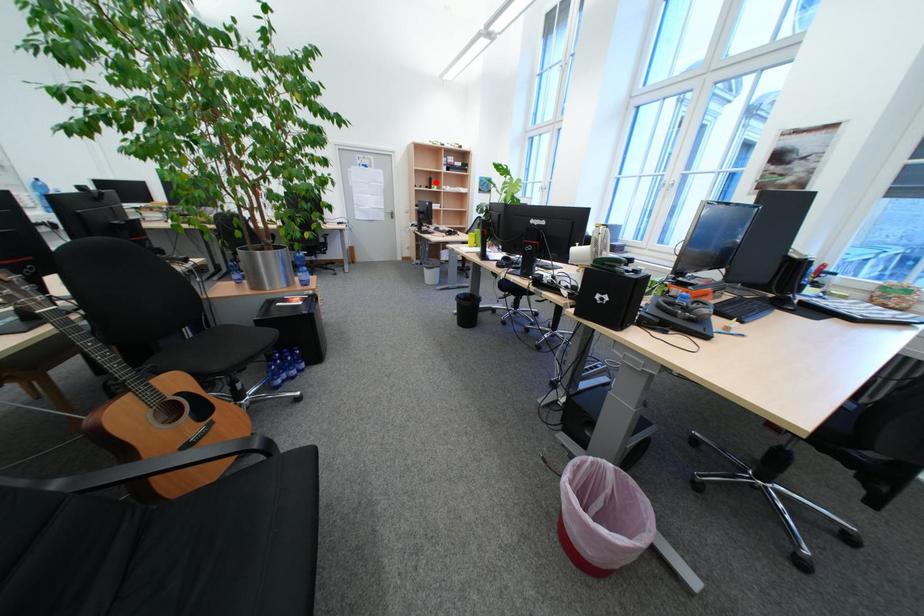
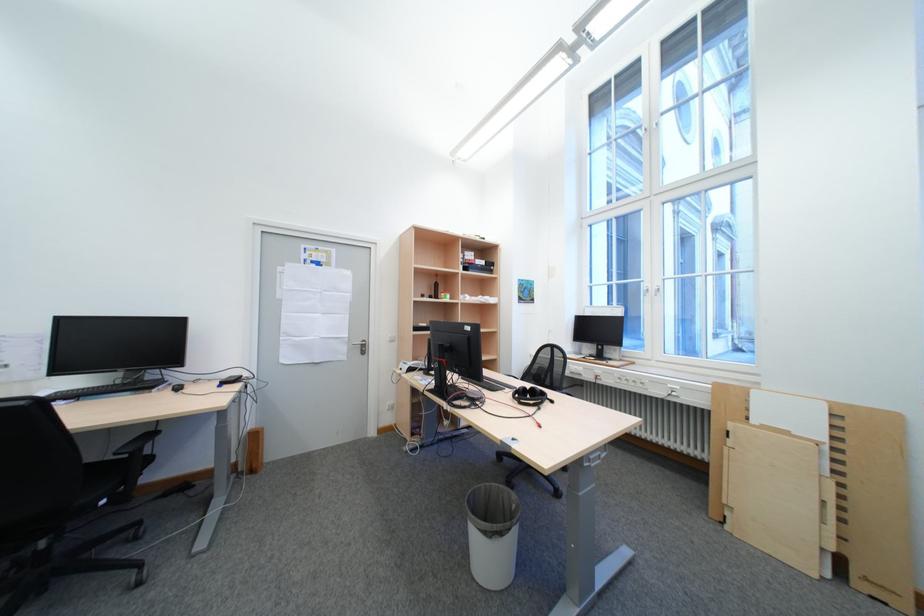
Question: A red point is marked in image1. In image2, is the corresponding 3D point closer to the camera or farther? Reply with the corresponding letter.

Choices:
 (A) The corresponding 3D point is closer.
 (B) The corresponding 3D point is farther.

Answer: (B)